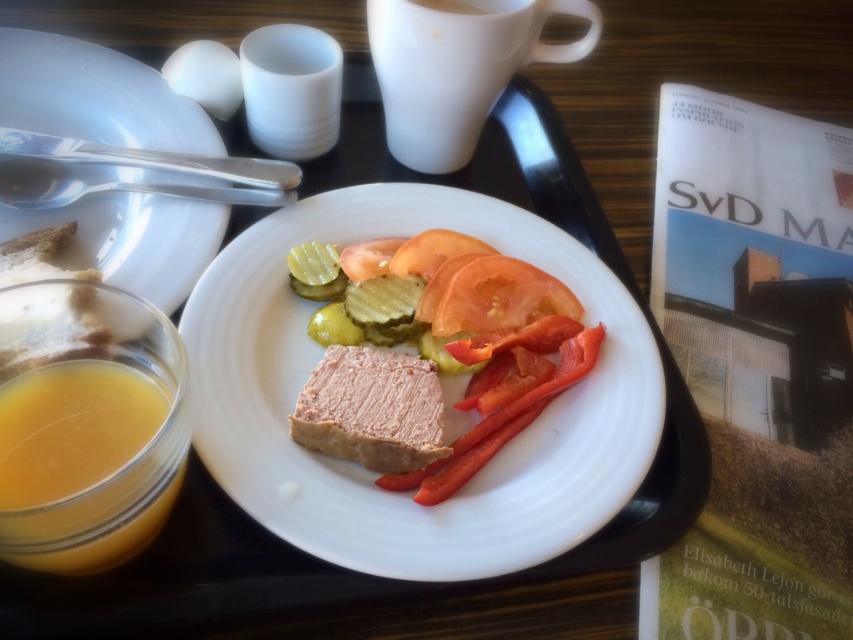
Describe the element at coordinates (96, 96) in the screenshot. This screenshot has height=640, width=853. I see `white glossy plate at upper left` at that location.

Is white glossy plate at upper left positioned in front of sliced red tomato at center?

That is False.

Which is in front, point (6, 58) or point (473, 294)?

Positioned in front is point (473, 294).

Find the location of a particular element. The width and height of the screenshot is (853, 640). white glossy plate at upper left is located at coordinates (96, 96).

Describe the element at coordinates (106, 508) in the screenshot. The image size is (853, 640). I see `translucent yellow liquid at bottom left` at that location.

Is translucent yellow liquid at bottom left taller than sliced matte tomato at center?

Yes.

Identify the location of translucent yellow liquid at bottom left. (106, 508).

Locate an element on the screen. translucent yellow liquid at bottom left is located at coordinates (106, 508).

Between white matte plate at center and pinkish matte/powdery spread at center, which one has less height?

pinkish matte/powdery spread at center

Can you confirm if white matte plate at center is wider than pinkish matte/powdery spread at center?

Yes.

The width and height of the screenshot is (853, 640). What do you see at coordinates (375, 472) in the screenshot? I see `white matte plate at center` at bounding box center [375, 472].

Find the location of a particular element. Image resolution: width=853 pixels, height=640 pixels. white matte plate at center is located at coordinates (375, 472).